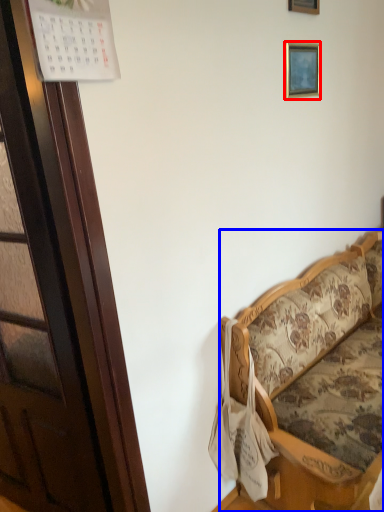
Question: Which object is closer to the camera taking this photo, picture frame (highlighted by a red box) or studio couch (highlighted by a blue box)?

Choices:
 (A) picture frame
 (B) studio couch

Answer: (B)